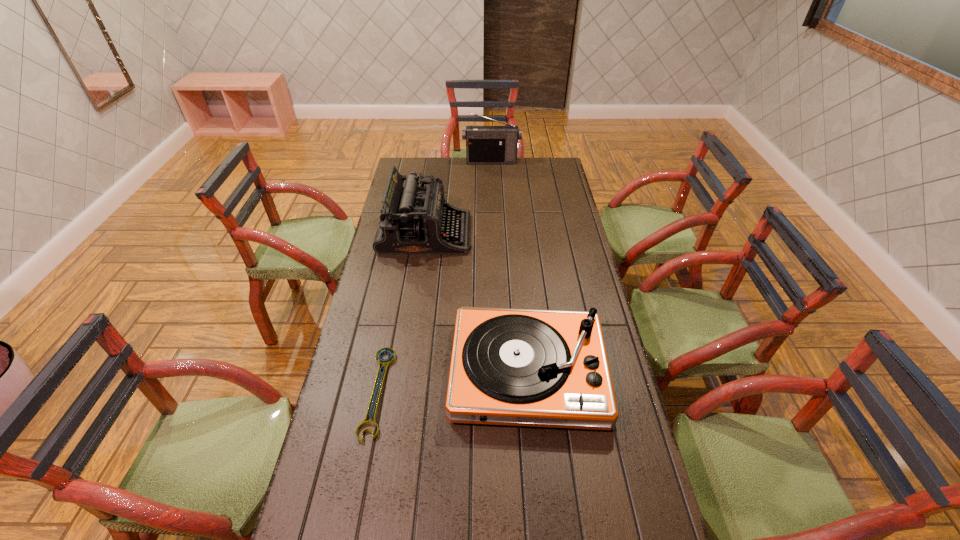
You are a GUI agent. You are given a task and a screenshot of the screen. Output one action in this format:
    pyautogui.click(x=<x>, y=<y>)
    Task: Click on the farthest object
    
    Given the screenshot: What is the action you would take?
    pyautogui.click(x=484, y=144)

Image resolution: width=960 pixels, height=540 pixels. I want to click on the third nearest object, so click(414, 220).

The image size is (960, 540). What are the coordinates of `record player` in the screenshot? It's located at (521, 367).

What are the coordinates of `the shortest object` in the screenshot? It's located at (383, 362).

Identify the location of blank area located 0.080m on the front-facing side of the radio receiver. (492, 172).

The height and width of the screenshot is (540, 960). Find the location of `free location located on the keyboard of the typewriter`. free location located on the keyboard of the typewriter is located at coordinates (560, 233).

Where is `free location located 0.400m on the back of the third tallest object`? free location located 0.400m on the back of the third tallest object is located at coordinates (516, 247).

At what (x,y) coordinates should I click in order to perform the action: click on free location located on the right of the wrench. Please return your answer as a coordinate pair (x, y). This screenshot has width=960, height=540. Looking at the image, I should click on (410, 392).

Identify the location of object located in the far edge section of the desktop. (484, 144).

Identify the location of typewriter that is at the left edge. The width and height of the screenshot is (960, 540). (414, 220).